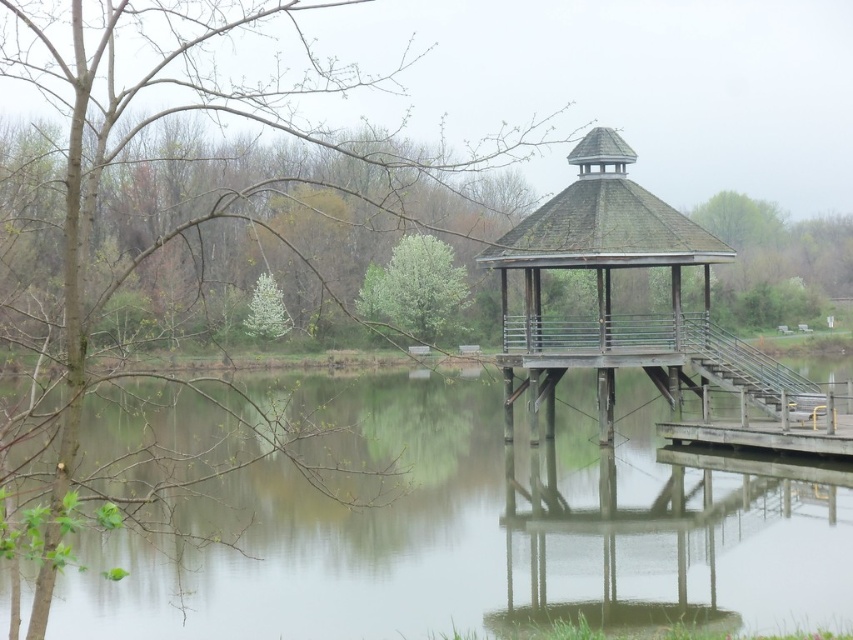
You are standing at the wooden stairs at lower right and want to walk towards the green leafy tree at center. Which direction should you move to get closer to the tree?

Since the wooden stairs at lower right are closer to the viewer than the green leafy tree at center, you should move forward towards the tree to get closer.

You are standing at the lakeside and want to take a photo of both the transparent water at center and the wooden gazebo at center. Which object should you adjust your camera angle to capture first if you want to include both in your frame?

You should adjust your camera angle to capture the wooden gazebo at center first because it is taller than the transparent water at center, so you need to ensure it fits within the frame before focusing on the lower transparent water at center.

You are standing on the wooden gazebo and want to reach the green leafy tree at center. The transparent water at center is between you and the tree. Can you walk directly to the tree without getting wet?

The transparent water at center is 54.32 feet away from the green leafy tree at center. Since the water is between you and the tree, you would have to cross the water to reach the tree, which is not possible on foot. Therefore, you cannot walk directly to the green leafy tree at center without getting wet.